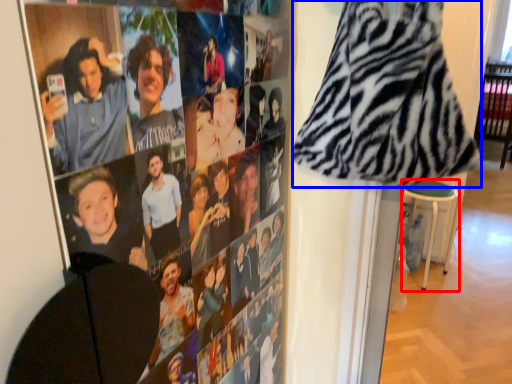
Question: Which object is closer to the camera taking this photo, bar stool (highlighted by a red box) or blanket (highlighted by a blue box)?

Choices:
 (A) bar stool
 (B) blanket

Answer: (B)